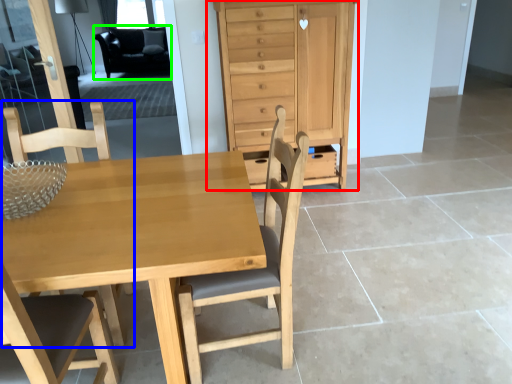
Question: Estimate the real-world distances between objects in this image. Which object is farther from chest of drawers (highlighted by a red box), chair (highlighted by a blue box) or armchair (highlighted by a green box)?

Choices:
 (A) chair
 (B) armchair

Answer: (B)